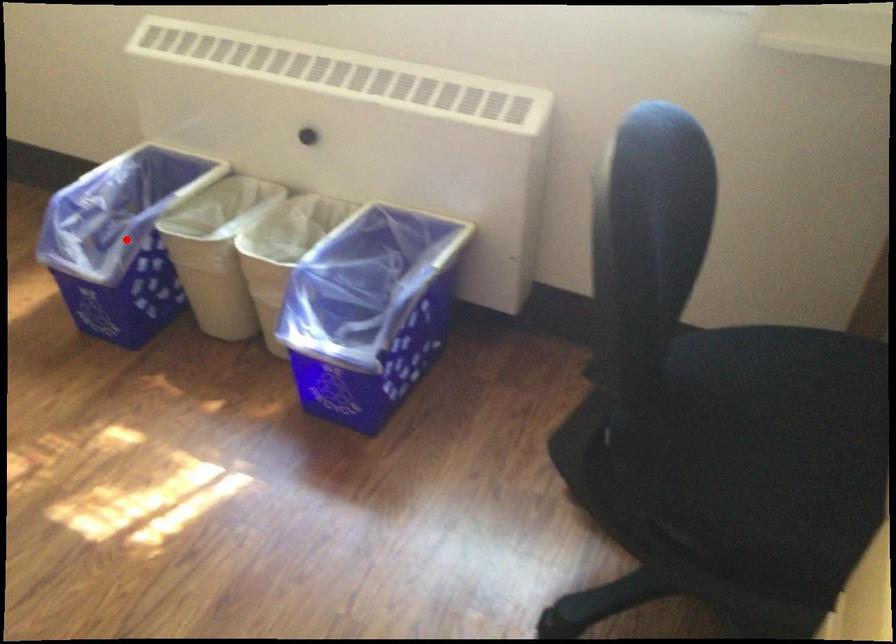
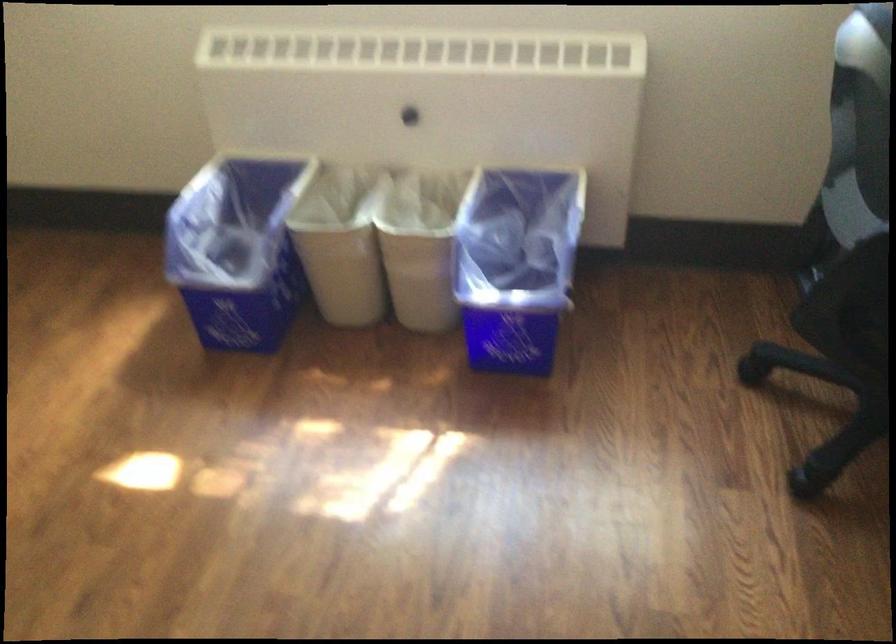
Find the pixel in the second image that matches the highlighted location in the first image.

(237, 249)